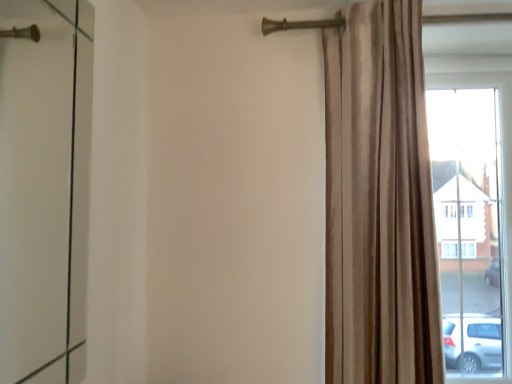
This screenshot has width=512, height=384. What do you see at coordinates (379, 201) in the screenshot? I see `satin beige curtain at right` at bounding box center [379, 201].

Find the location of a particular element. This screenshot has height=384, width=512. satin beige curtain at right is located at coordinates (379, 201).

This screenshot has width=512, height=384. In order to click on satin beige curtain at right in this screenshot , I will do `click(379, 201)`.